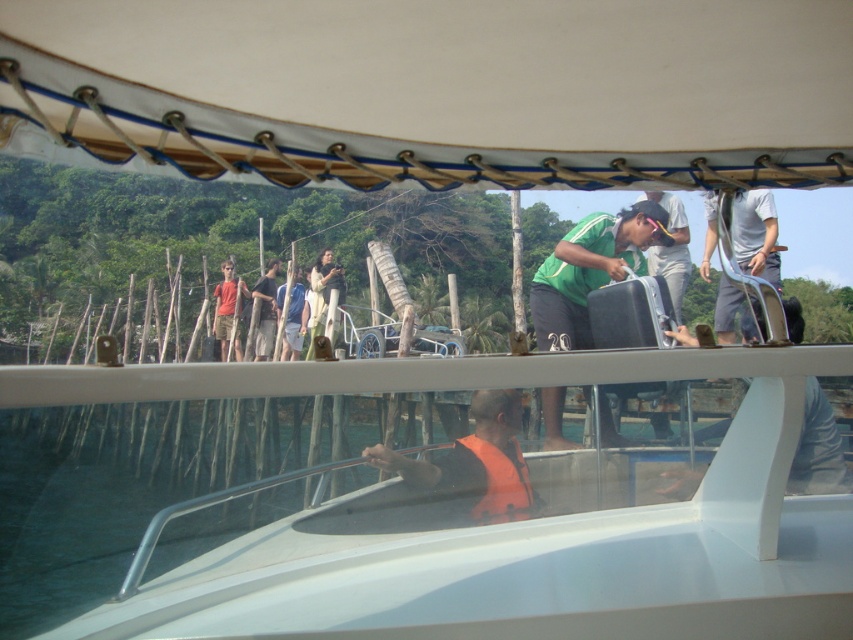
Question: Is green matte shirt at upper center thinner than light beige fabric dress at center?

Choices:
 (A) no
 (B) yes

Answer: (B)

Question: Which of the following is the farthest from the observer?

Choices:
 (A) (485, 470)
 (B) (265, 317)

Answer: (B)

Question: Estimate the real-world distances between objects in this image. Which object is farther from the light beige fabric dress at center?

Choices:
 (A) white fabric canopy at upper center
 (B) orange cotton shirt at left
 (C) blue fabric shirt at upper center
 (D) orange life vest at center

Answer: (A)

Question: Which object is the closest to the blue fabric shirt at upper center?

Choices:
 (A) white cotton shirt at upper right
 (B) orange cotton shirt at left

Answer: (B)

Question: Does white cotton shirt at upper right have a greater width compared to orange fabric life jacket at lower center?

Choices:
 (A) yes
 (B) no

Answer: (A)

Question: In this image, where is green fabric shirt at center located relative to light beige fabric dress at center?

Choices:
 (A) left
 (B) right

Answer: (B)